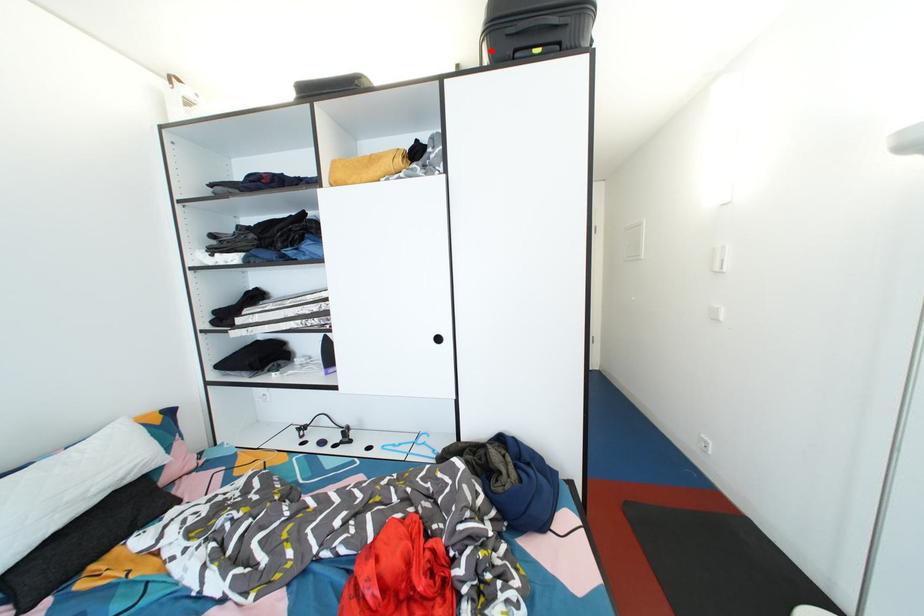
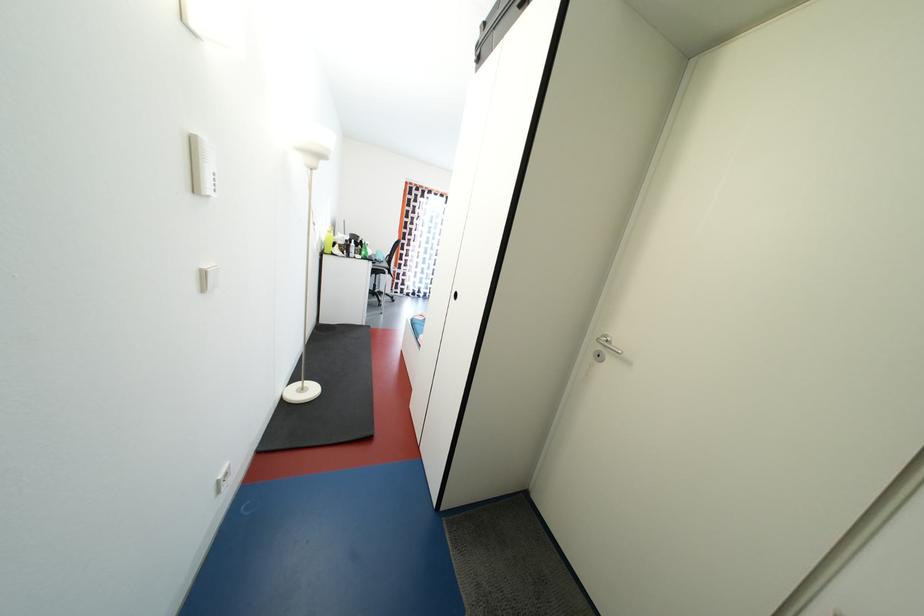
Question: I am providing you with two images of the same scene from different viewpoints. A red point is marked on the first image. At the location where the point appears in image 1, is it still visible in image 2?

Choices:
 (A) Yes
 (B) No

Answer: (B)